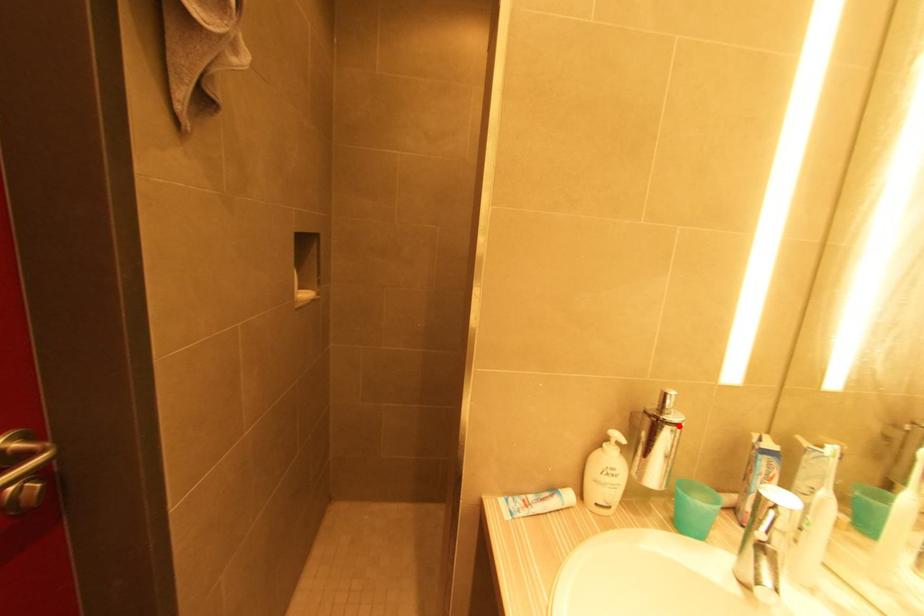
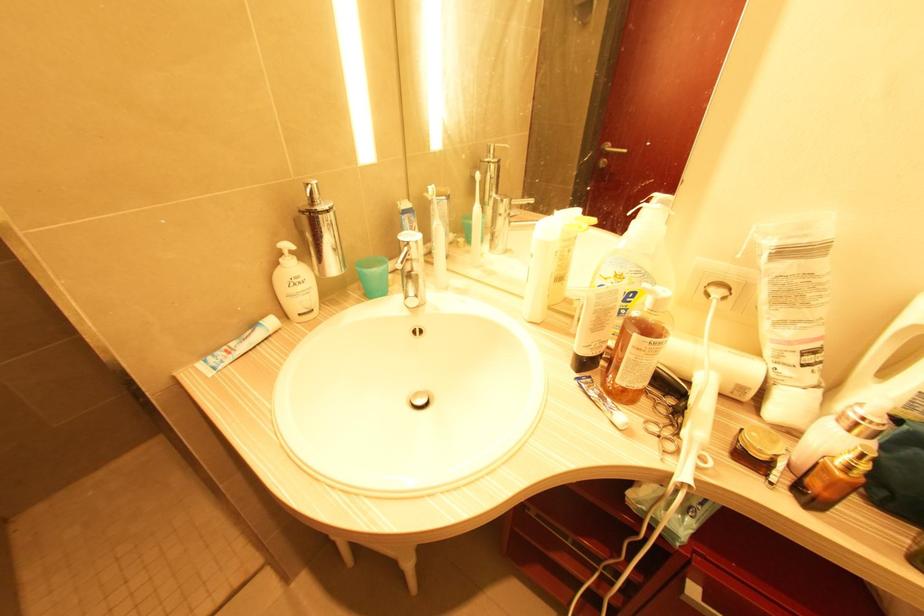
In the second image, find the point that corresponds to the highlighted location in the first image.

(329, 212)